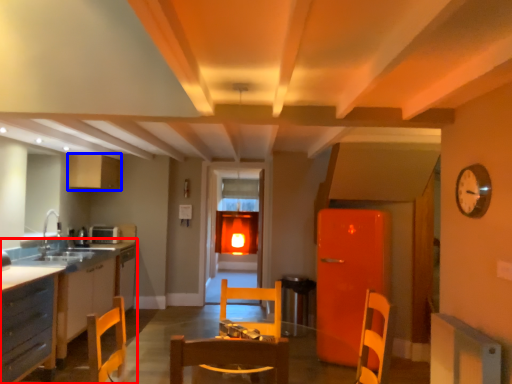
Question: Which point is further to the camera, countertop (highlighted by a red box) or cabinetry (highlighted by a blue box)?

Choices:
 (A) countertop
 (B) cabinetry

Answer: (B)